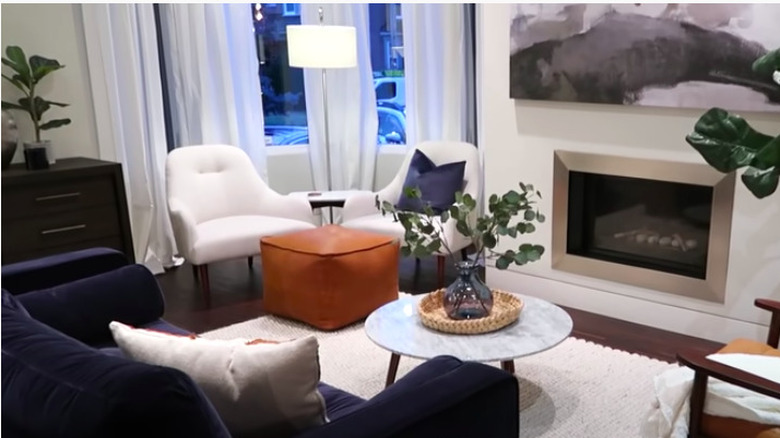
Image resolution: width=780 pixels, height=438 pixels. I want to click on throw pillows, so click(250, 374), click(440, 170).